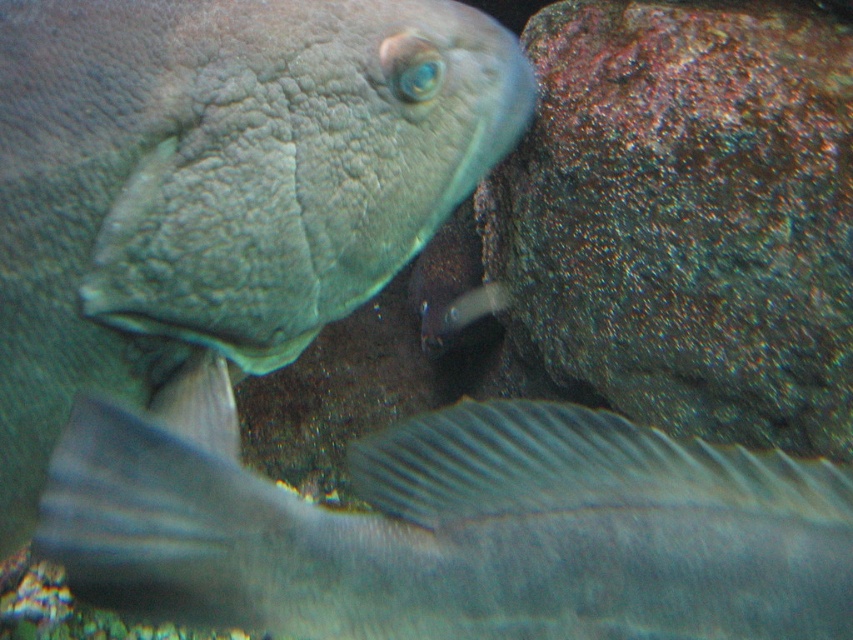
You are a marine biologist observing an aquarium. You notice a smooth gray fish at upper left. Can you determine its exact location in the aquarium using coordinates?

The smooth gray fish at upper left is located at coordinates point [218,184].

You are an aquarium caretaker who needs to feed the fish. You have a small net and want to catch the silvery textured fish at lower center without disturbing the rusty rock at right. Based on their positions, can you safely approach from the right side of the tank?

The silvery textured fish at lower center is to the left of the rusty rock at right, so approaching from the right side of the tank would allow you to target the fish without disturbing the rock.